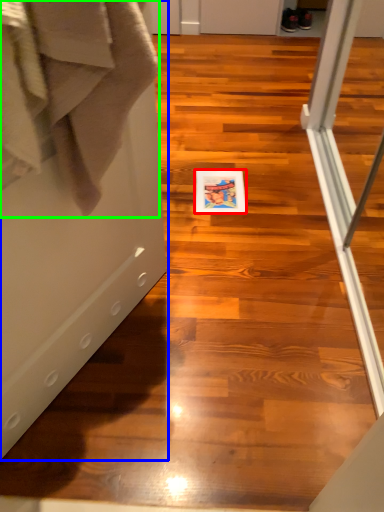
Question: Which object is the closest to the postcard (highlighted by a red box)? Choose among these: screen door (highlighted by a blue box) or bath towel (highlighted by a green box).

Choices:
 (A) screen door
 (B) bath towel

Answer: (A)